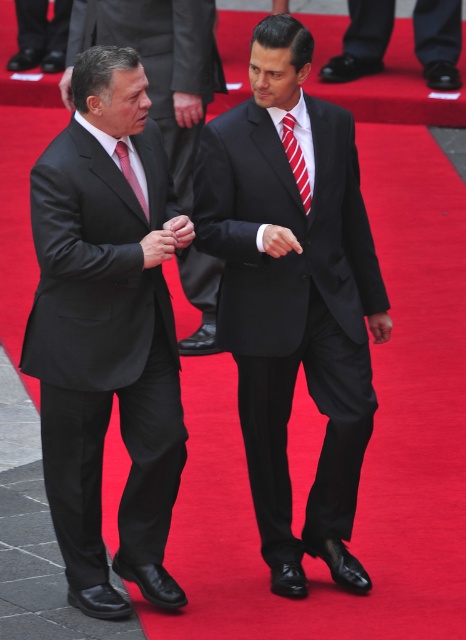
You are a photographer at a formal event and need to position your camera to capture the black matte suit at center. According to the coordinates provided, where should you aim your camera?

The black matte suit at center is located at coordinates point (102, 348), so you should aim your camera at that point to capture it.

You are a photographer at a formal event. You need to capture a photo of the matte black suit at left and the black leather shoes at lower center. Based on their positions, which object will appear closer to the camera in the photo?

The matte black suit at left will appear closer to the camera in the photo because it is positioned in front of the black leather shoes at lower center.